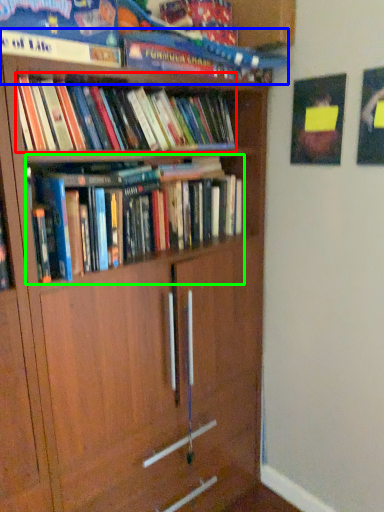
Question: Considering the real-world distances, which object is farthest from book (highlighted by a red box)? book (highlighted by a blue box) or book (highlighted by a green box)?

Choices:
 (A) book
 (B) book

Answer: (B)